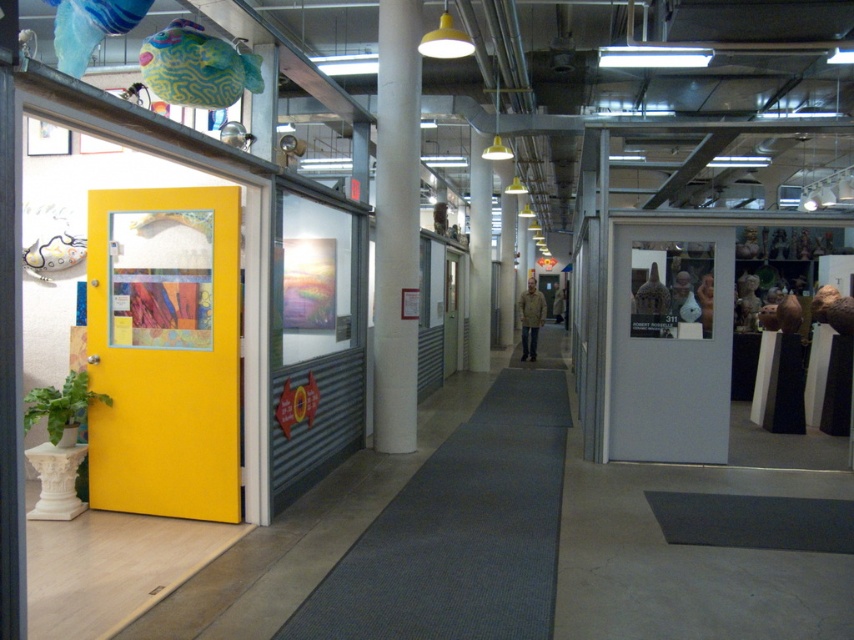
Question: Can you confirm if white smooth pillar at center is positioned above tan textured jacket at center?

Choices:
 (A) yes
 (B) no

Answer: (A)

Question: Does white smooth pillar at center appear under tan textured jacket at center?

Choices:
 (A) yes
 (B) no

Answer: (B)

Question: Does white smooth pillar at center appear on the right side of tan textured jacket at center?

Choices:
 (A) no
 (B) yes

Answer: (A)

Question: Which of the following is the farthest from the observer?

Choices:
 (A) (533, 317)
 (B) (411, 10)

Answer: (A)